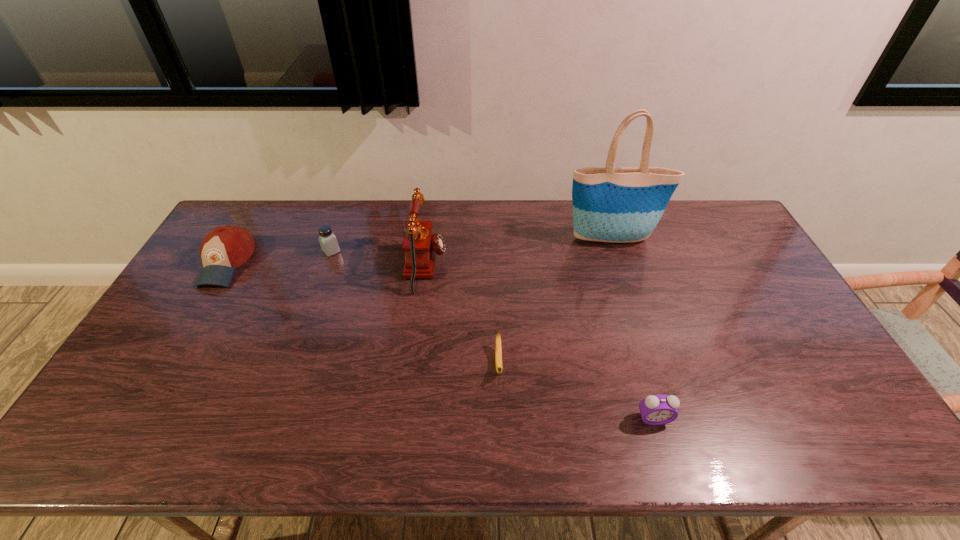
This screenshot has width=960, height=540. What are the coordinates of `free space between the fifth object from right to left and the alarm clock` in the screenshot? It's located at (492, 335).

Locate an element on the screen. free space between the fifth shortest object and the banana is located at coordinates (462, 315).

The width and height of the screenshot is (960, 540). Find the location of `vacant space that's between the third object from left to right and the leftmost object`. vacant space that's between the third object from left to right and the leftmost object is located at coordinates (326, 265).

The image size is (960, 540). Identify the location of free space between the saltshaker and the leftmost object. (279, 257).

Locate which object ranks in proximity to the telephone. Please provide its 2D coordinates. Your answer should be formatted as a tuple, i.e. [(x, y)], where the tuple contains the x and y coordinates of a point satisfying the conditions above.

[(328, 242)]

Identify which object is the fifth closest to the saltshaker. Please provide its 2D coordinates. Your answer should be formatted as a tuple, i.e. [(x, y)], where the tuple contains the x and y coordinates of a point satisfying the conditions above.

[(660, 409)]